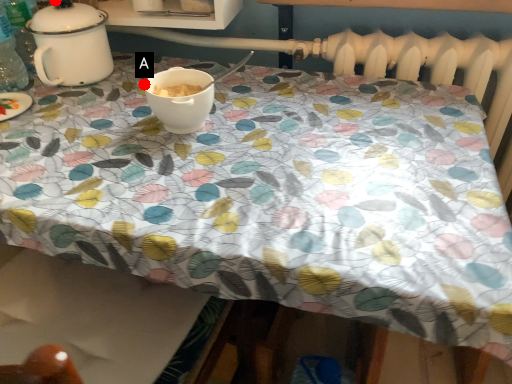
Question: Two points are circled on the image, labeled by A and B beside each circle. Which point is closer to the camera?

Choices:
 (A) A is closer
 (B) B is closer

Answer: (A)